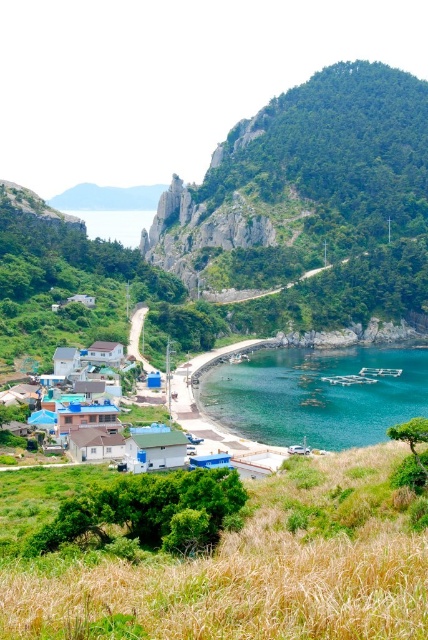
Does white matte house at lower left appear under light blue corrugated metal hut at lower left?

Correct, white matte house at lower left is located below light blue corrugated metal hut at lower left.

How distant is white matte house at lower left from light blue corrugated metal hut at lower left?

white matte house at lower left is 16.46 feet away from light blue corrugated metal hut at lower left.

Who is more forward, (x=109, y=438) or (x=68, y=433)?

Positioned in front is point (x=109, y=438).

Locate an element on the screen. white matte house at lower left is located at coordinates (95, 444).

Can you confirm if white matte house at lower left is wider than white matte house at center?

Yes, white matte house at lower left is wider than white matte house at center.

Can you confirm if white matte house at lower left is smaller than white matte house at center?

Yes.

Describe the element at coordinates (95, 444) in the screenshot. I see `white matte house at lower left` at that location.

What are the coordinates of `white matte house at lower left` in the screenshot? It's located at (95, 444).

You are a GUI agent. You are given a task and a screenshot of the screen. Output one action in this format:
    pyautogui.click(x=<x>, y=<y>)
    Task: Click on the green leafy mountain at upper center
    The height and width of the screenshot is (640, 428).
    Given the screenshot: What is the action you would take?
    pyautogui.click(x=309, y=193)

Measure the distance from green leafy mountain at upper center to white matte hut at center.

They are 680.51 feet apart.

Where is `green leafy mountain at upper center`? The image size is (428, 640). green leafy mountain at upper center is located at coordinates (309, 193).